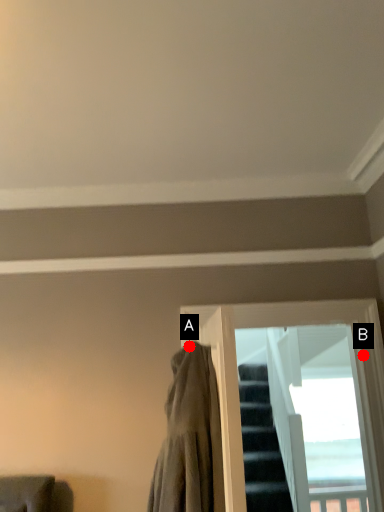
Question: Two points are circled on the image, labeled by A and B beside each circle. Which point is farther from the camera taking this photo?

Choices:
 (A) A is further
 (B) B is further

Answer: (B)